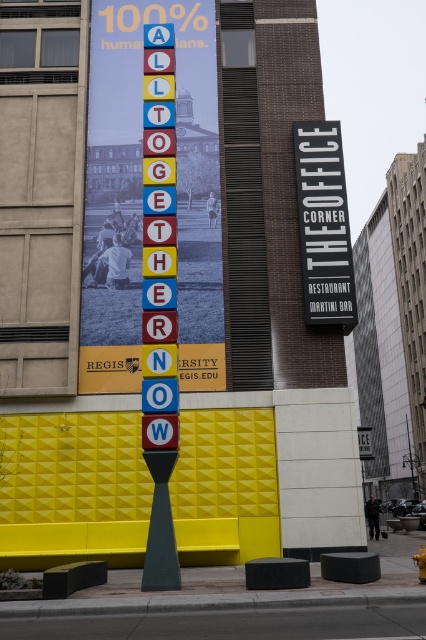
You are a pedestrian standing in front of the building. You notice two signs on the facade. Which one, the metallic signboard at center or the black plastic sign at upper right, is closer to you?

The metallic signboard at center is closer to you because it is in front of the black plastic sign at upper right.